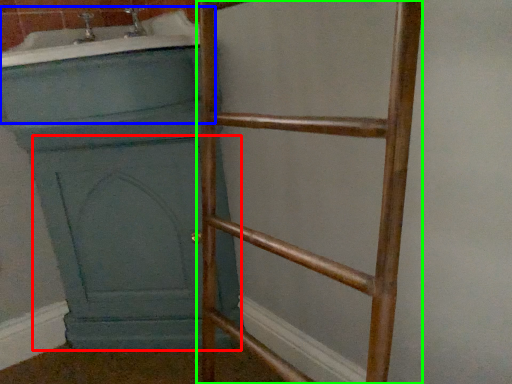
Question: Estimate the real-world distances between objects in this image. Which object is farther from screen door (highlighted by a red box), bath (highlighted by a blue box) or ladder (highlighted by a green box)?

Choices:
 (A) bath
 (B) ladder

Answer: (A)